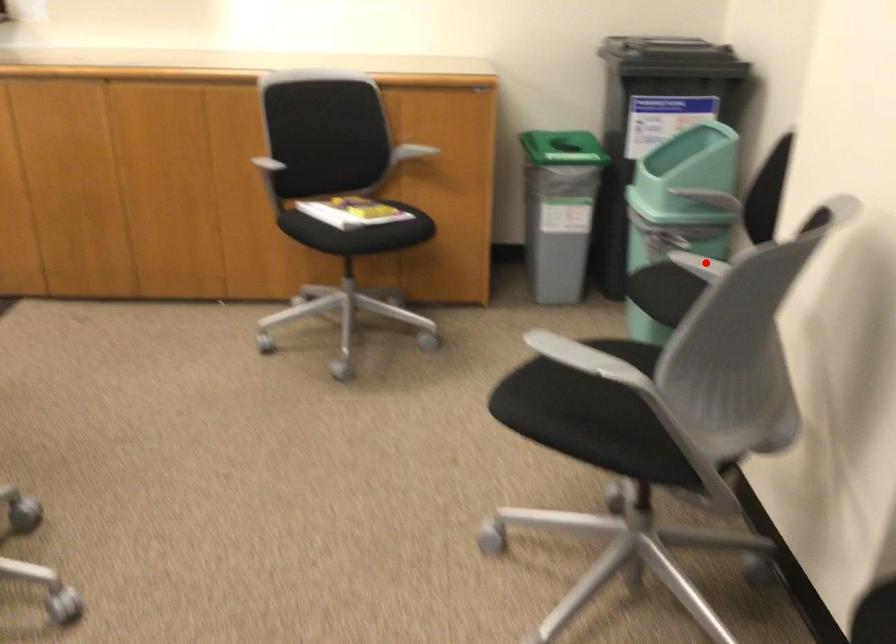
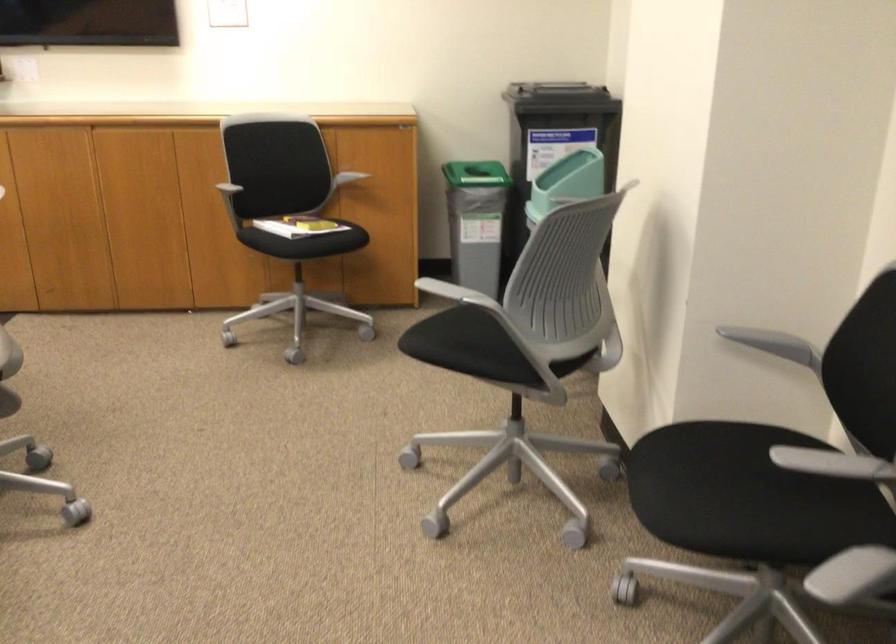
Question: I am providing you with two images of the same scene from different viewpoints. A red point is marked on the first image. Is the red point's position out of view in image 2?

Choices:
 (A) Yes
 (B) No

Answer: (A)